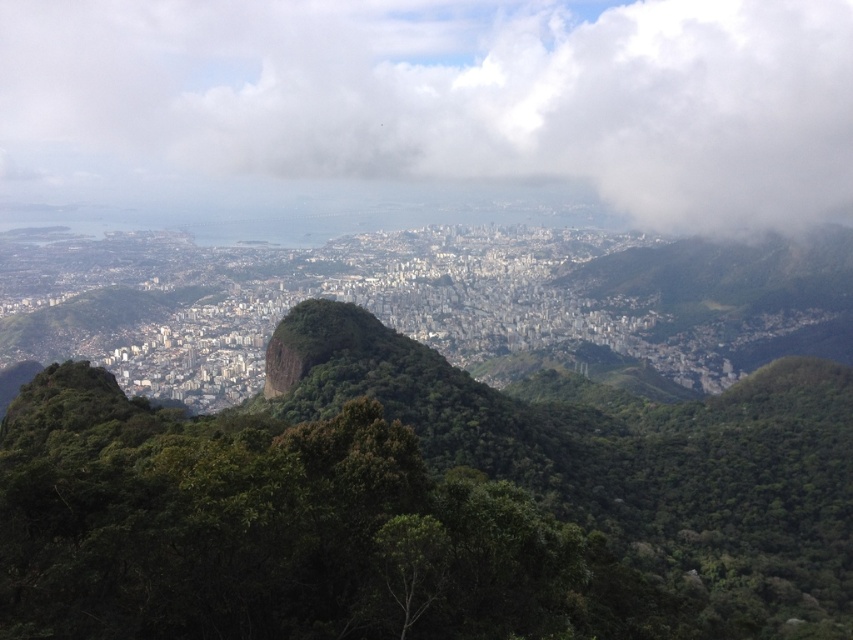
You are an architect designing a new observation deck. You want to ensure that the view of the white fluffy cloud at upper center isn not obstructed by the green rough rock at center. Based on their sizes, which object would require more consideration in terms of positioning the deck to avoid blocking the view?

The white fluffy cloud at upper center has a larger width than the green rough rock at center. Since the cloud is wider, positioning the observation deck might require more careful planning to ensure its view isn obstructed by the rock, as the cloud takes up more of the visual space.

You are an airplane passenger looking out the window. You see the white fluffy cloud at upper center and the green rough rock at center. Which object is closer to the airplane?

The green rough rock at center is closer to the airplane because the white fluffy cloud at upper center is further to the viewer than the green rough rock at center.

From the picture: You are an airplane passenger looking out the window and see the white fluffy cloud at upper center and the green rough rock at center. Which object is positioned more to the east if the airplane is facing north?

The white fluffy cloud at upper center is positioned more to the east because it is to the right of the green rough rock at center, and when facing north, right corresponds to east.